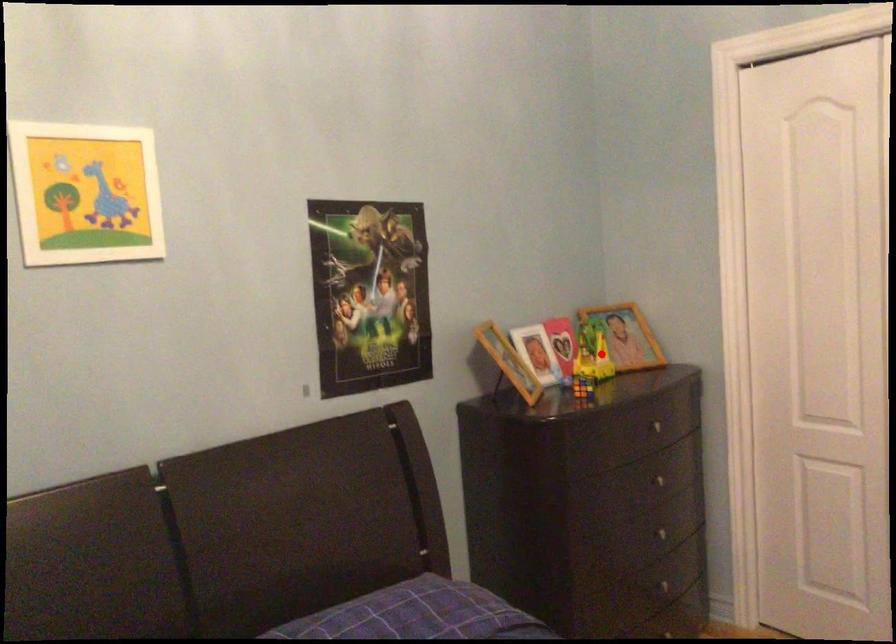
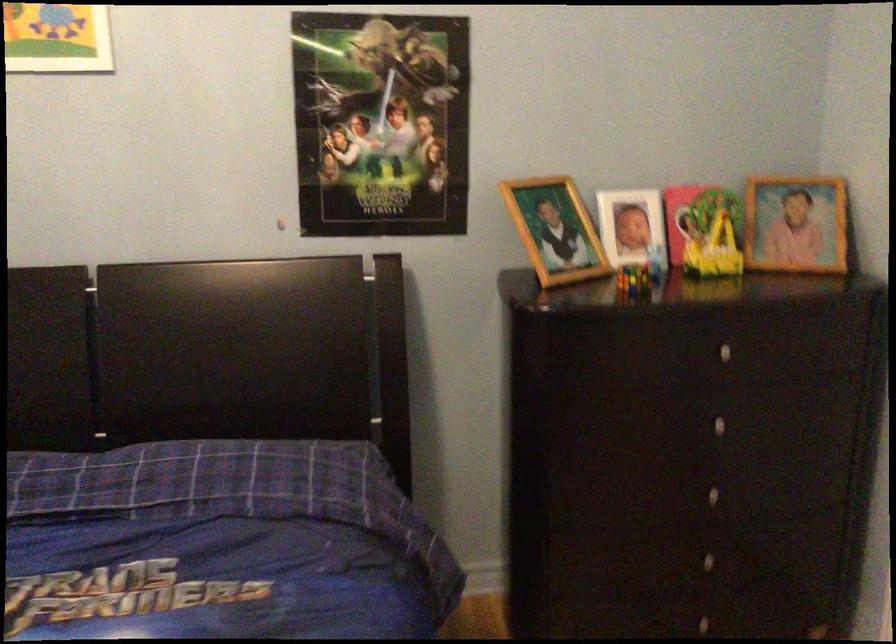
Question: I am providing you with two images of the same scene from different viewpoints. Given a red point in image1, look at the same physical point in image2. Is it:

Choices:
 (A) Closer to the viewpoint
 (B) Farther from the viewpoint

Answer: (A)